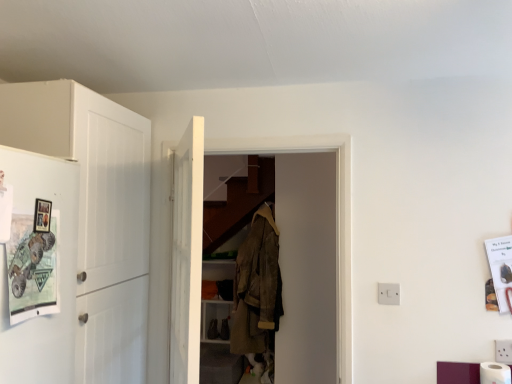
Question: Is camouflage fabric jacket at center inside or outside of white matte cabinet at left?

Choices:
 (A) inside
 (B) outside

Answer: (B)

Question: From their relative heights in the image, would you say camouflage fabric jacket at center is taller or shorter than white matte cabinet at left?

Choices:
 (A) tall
 (B) short

Answer: (B)

Question: Which object is the closest to the white plastic electric outlet at center right?

Choices:
 (A) matte white fridge at left
 (B) white matte toilet paper at lower right
 (C) white wooden door at center
 (D) camouflage fabric jacket at center
 (E) white matte cabinet at left

Answer: (B)

Question: Which object is the farthest from the white matte toilet paper at lower right?

Choices:
 (A) white matte cabinet at left
 (B) camouflage fabric jacket at center
 (C) white plastic electric outlet at center right
 (D) white wooden door at center
 (E) matte white fridge at left

Answer: (E)